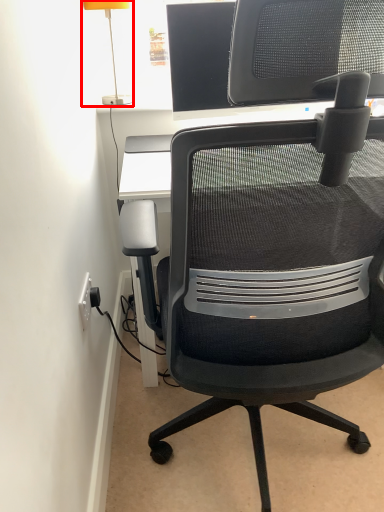
Question: Where is table lamp (annotated by the red box) located in relation to chair in the image?

Choices:
 (A) left
 (B) right

Answer: (A)